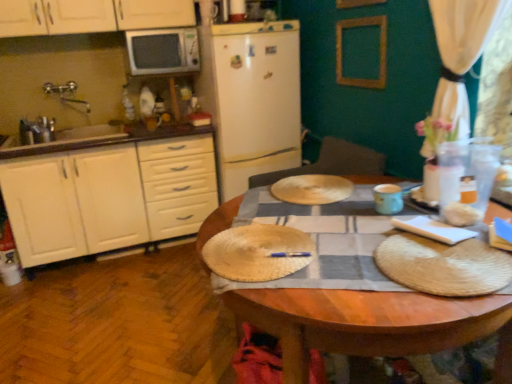
The height and width of the screenshot is (384, 512). I want to click on unoccupied space behind bamboo placemat at center, so click(x=264, y=211).